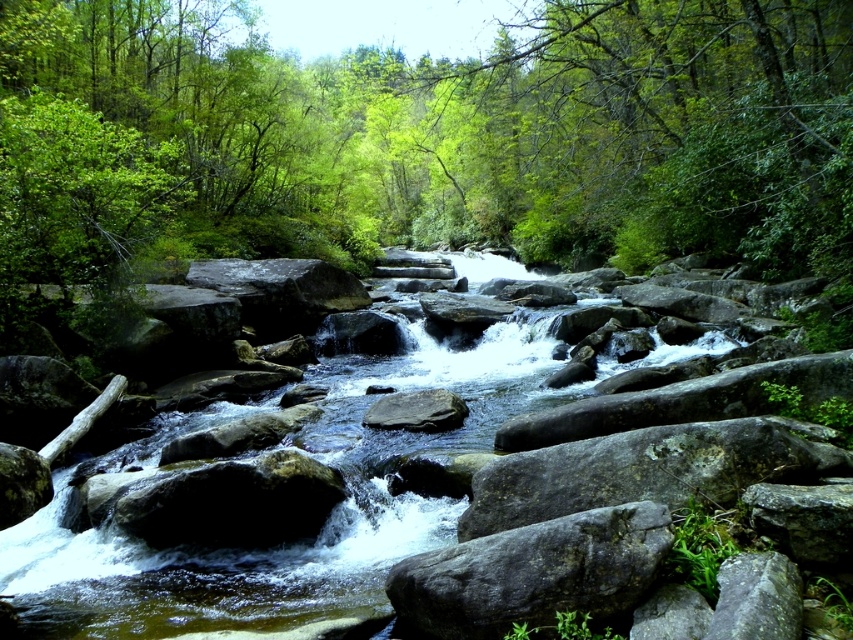
Can you confirm if dark gray rock at center is bigger than smooth gray rock at center?

Indeed, dark gray rock at center has a larger size compared to smooth gray rock at center.

Does dark gray rock at center have a lesser width compared to smooth gray rock at center?

No.

Which is behind, point (200, 528) or point (432, 429)?

The point (432, 429) is behind.

The height and width of the screenshot is (640, 853). Find the location of `dark gray rock at center`. dark gray rock at center is located at coordinates (234, 502).

Is gray mossy rock at center shorter than dark gray rock at center?

In fact, gray mossy rock at center may be taller than dark gray rock at center.

Does point (722, 429) come farther from viewer compared to point (169, 506)?

No, it is in front of (169, 506).

The image size is (853, 640). I want to click on gray mossy rock at center, so click(643, 470).

Who is more distant from viewer, (733,474) or (636,532)?

Positioned behind is point (733,474).

Image resolution: width=853 pixels, height=640 pixels. Describe the element at coordinates (643, 470) in the screenshot. I see `gray mossy rock at center` at that location.

The width and height of the screenshot is (853, 640). What do you see at coordinates (643, 470) in the screenshot?
I see `gray mossy rock at center` at bounding box center [643, 470].

At what (x,y) coordinates should I click in order to perform the action: click on gray mossy rock at center. Please return your answer as a coordinate pair (x, y). Looking at the image, I should click on pos(643,470).